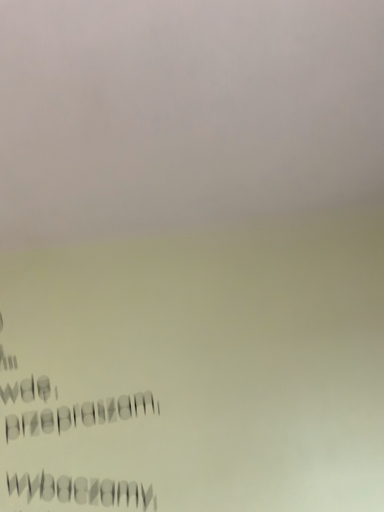
What do you see at coordinates (184, 113) in the screenshot?
I see `white matte paper at upper center` at bounding box center [184, 113].

Where is `white matte paper at upper center`? This screenshot has height=512, width=384. white matte paper at upper center is located at coordinates point(184,113).

Find the location of `white matte paper at upper center`. white matte paper at upper center is located at coordinates (184, 113).